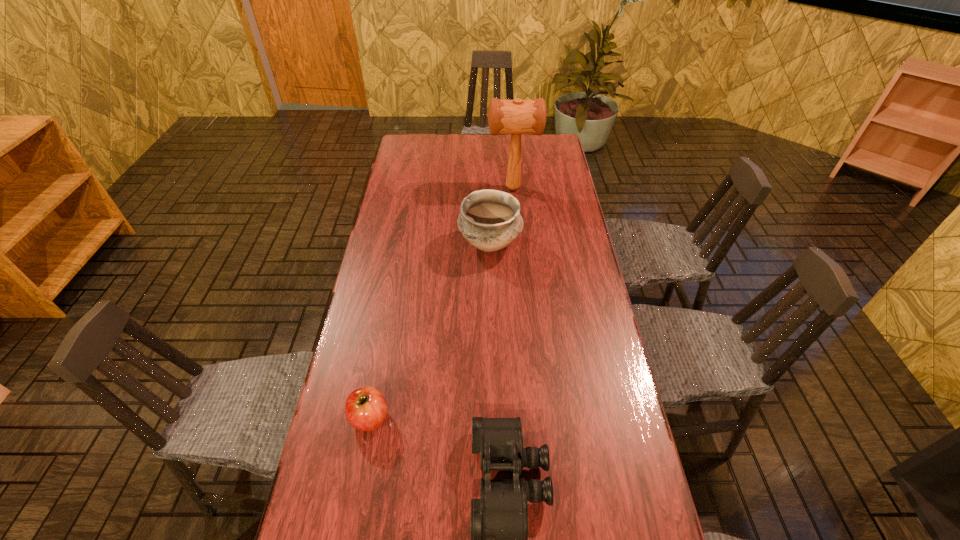
Identify the location of object that is at the left edge. (366, 409).

Where is `object present at the right edge`? Image resolution: width=960 pixels, height=540 pixels. object present at the right edge is located at coordinates (515, 117).

The width and height of the screenshot is (960, 540). Find the location of `free region at the far edge of the desktop`. free region at the far edge of the desktop is located at coordinates (451, 144).

Where is `free location at the left edge of the desktop`? free location at the left edge of the desktop is located at coordinates (385, 449).

Locate an element on the screen. The width and height of the screenshot is (960, 540). blank space at the right edge of the desktop is located at coordinates (541, 222).

Where is `blank area at the far left corner`? The height and width of the screenshot is (540, 960). blank area at the far left corner is located at coordinates (430, 143).

Locate an element on the screen. This screenshot has width=960, height=540. free area in between the second farthest object and the leftmost object is located at coordinates (430, 331).

Locate an element on the screen. The height and width of the screenshot is (540, 960). free space that is in between the apple and the mallet is located at coordinates (x=442, y=303).

Locate an element on the screen. object that can be found as the second closest to the mallet is located at coordinates (366, 409).

At what (x,y) coordinates should I click in order to perform the action: click on object that is the second closest to the apple. Please return your answer as a coordinate pair (x, y). The height and width of the screenshot is (540, 960). Looking at the image, I should click on (490, 220).